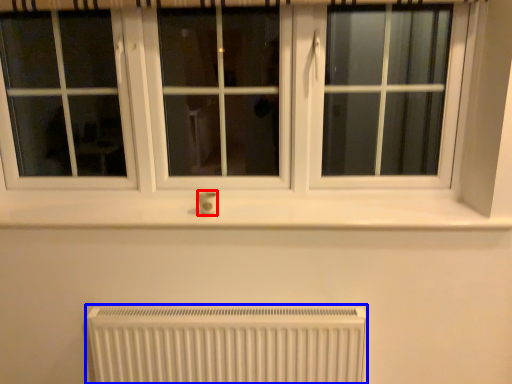
Question: Which point is further to the camera, electric outlet (highlighted by a red box) or radiator (highlighted by a blue box)?

Choices:
 (A) electric outlet
 (B) radiator

Answer: (A)